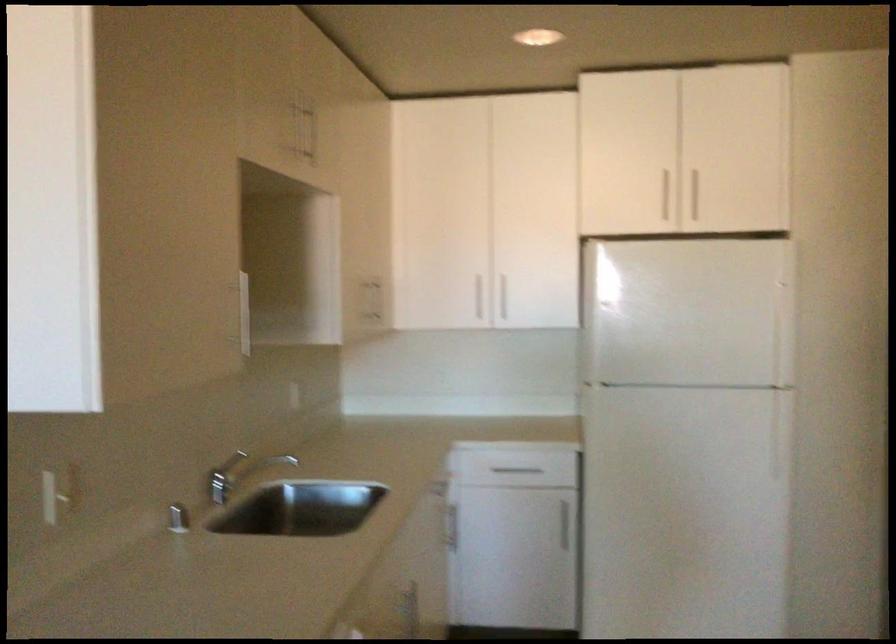
What do you see at coordinates (222, 478) in the screenshot? I see `a faucet lever handle` at bounding box center [222, 478].